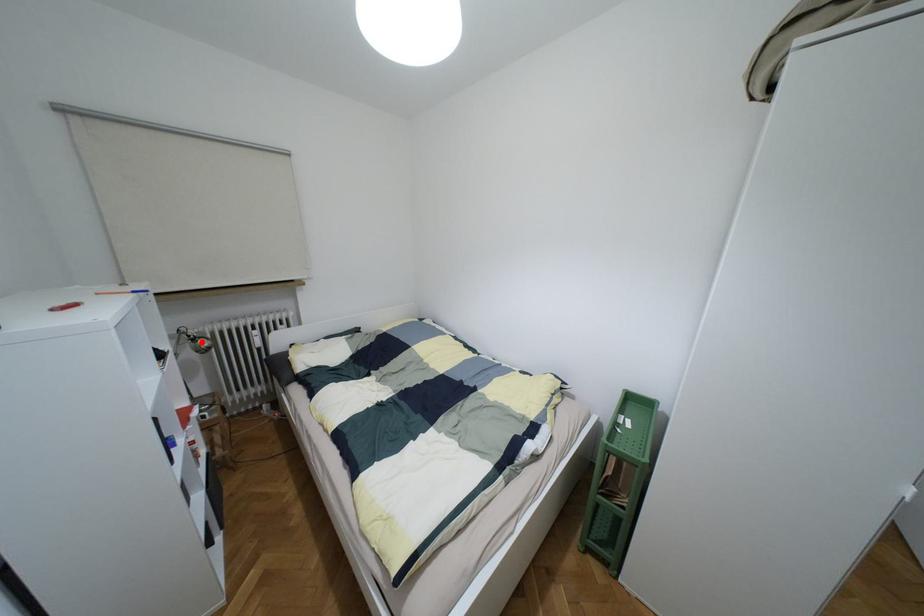
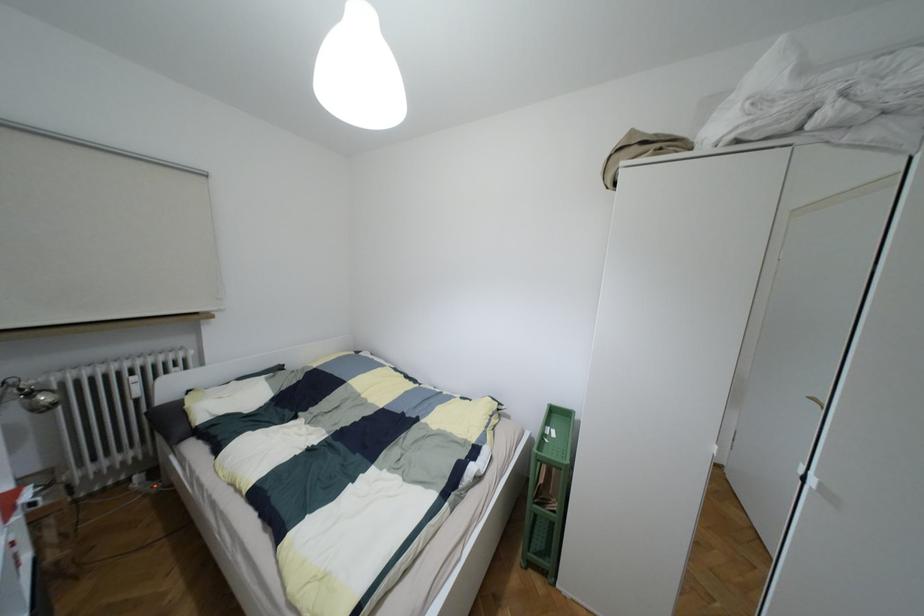
Question: I am providing you with two images of the same scene from different viewpoints. Given a red point in image1, look at the same physical point in image2. Is it:

Choices:
 (A) Closer to the viewpoint
 (B) Farther from the viewpoint

Answer: (B)